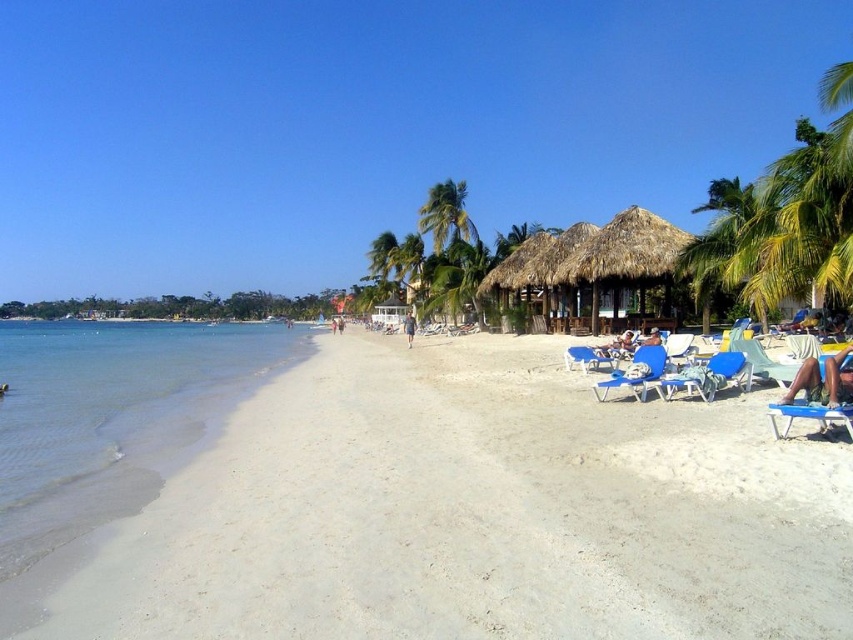
You are standing on the beach and want to take a photo of the green leafy palm tree at upper right. Based on its position at point (x=785, y=216), where should you aim your camera?

The green leafy palm tree at upper right is located at point (x=785, y=216), so you should aim your camera towards the upper right area of the image to capture it.

You are standing on the beach and want to take a photo of both the green leafy palm tree at upper right and the light brown skin at center. Which object should you focus on first to ensure both are in focus?

You should focus on the green leafy palm tree at upper right first because it is closer to you than the light brown skin at center, so adjusting focus from near to far will help both be in focus.

You are a beachgoer who wants to set up your blue plastic beach chair at center near the water. Based on the scene, can you place it closer to the clear water at left without it getting wet?

The clear water at left has a larger size compared to the blue plastic beach chair at center. Since the water is larger and extends further towards the shore, placing the blue plastic beach chair at center closer to the clear water at left might risk it getting wet during high tide or wave activity. Choose a spot slightly further inland for safety.